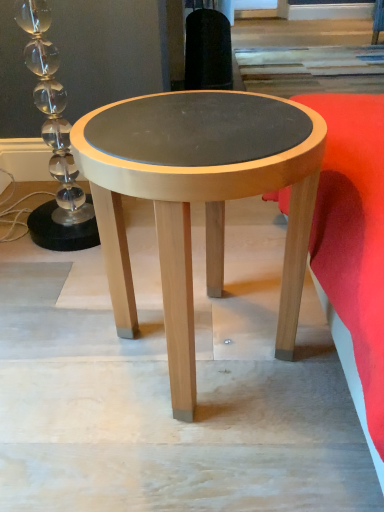
Locate an element on the screen. blank area beneath matte wood coffee table at center (from a real-world perspective) is located at coordinates (203, 346).